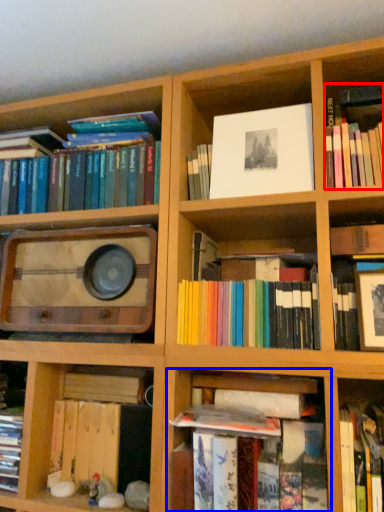
Question: Among these objects, which one is nearest to the camera, book (highlighted by a red box) or shelf (highlighted by a blue box)?

Choices:
 (A) book
 (B) shelf

Answer: (B)